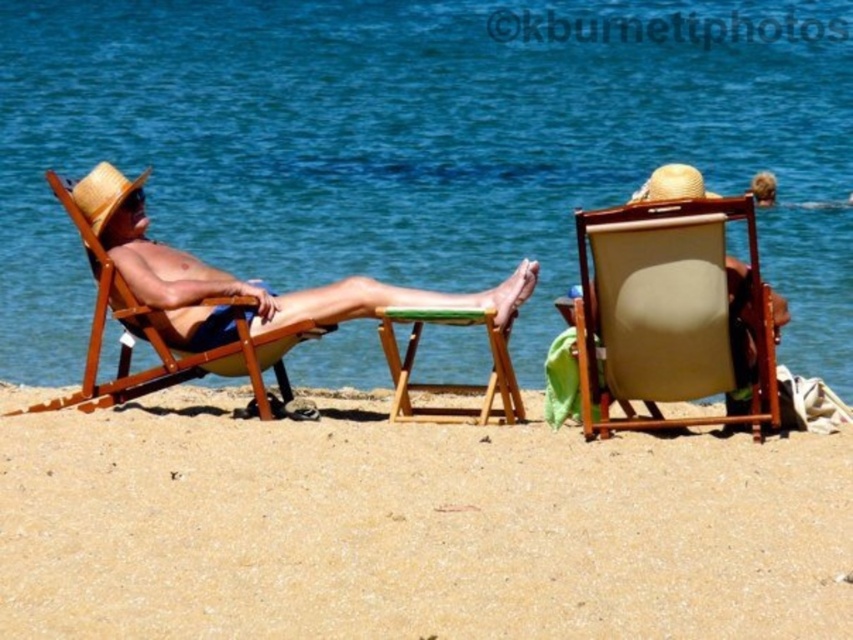
Question: Considering the real-world distances, which object is closest to the blue water at center?

Choices:
 (A) beige sandy beach at lower center
 (B) green wood stool at center
 (C) wooden beach chair at left
 (D) matte straw hat at center

Answer: (A)

Question: Can you confirm if beige sandy beach at lower center is positioned below green wood stool at center?

Choices:
 (A) no
 (B) yes

Answer: (B)

Question: Which of these objects is positioned farthest from the straw hat at upper right?

Choices:
 (A) blue water at center
 (B) beige fabric beach chair at center
 (C) wooden beach chair at left
 (D) green wood stool at center

Answer: (A)

Question: Can you confirm if beige fabric beach chair at center is positioned to the left of matte straw hat at center?

Choices:
 (A) yes
 (B) no

Answer: (B)

Question: Can you confirm if beige sandy beach at lower center is positioned above green wood stool at center?

Choices:
 (A) yes
 (B) no

Answer: (B)

Question: Which is nearer to the beige fabric beach chair at center?

Choices:
 (A) straw hat at upper right
 (B) strawmaterial/texturehat at left
 (C) blue water at center

Answer: (A)